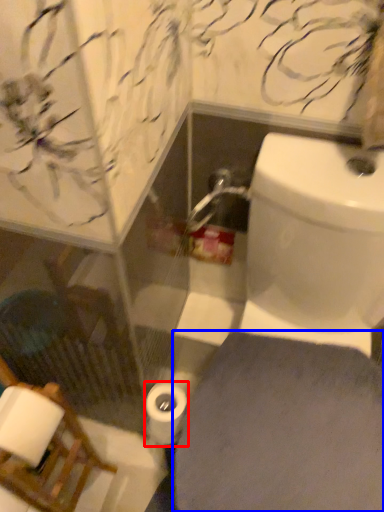
Question: Which object appears closest to the camera in this image, toilet paper (highlighted by a red box) or porcelain (highlighted by a blue box)?

Choices:
 (A) toilet paper
 (B) porcelain

Answer: (B)